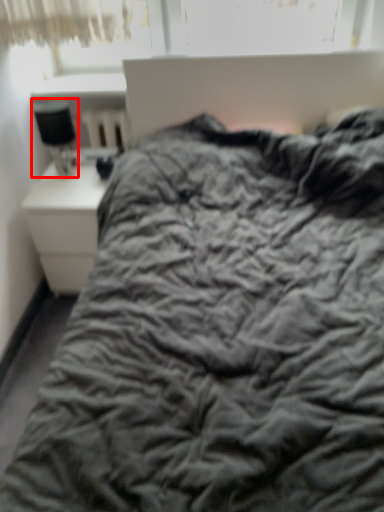
Question: From the image's perspective, what is the correct spatial relationship of table lamp (annotated by the red box) in relation to nightstand?

Choices:
 (A) below
 (B) above

Answer: (B)